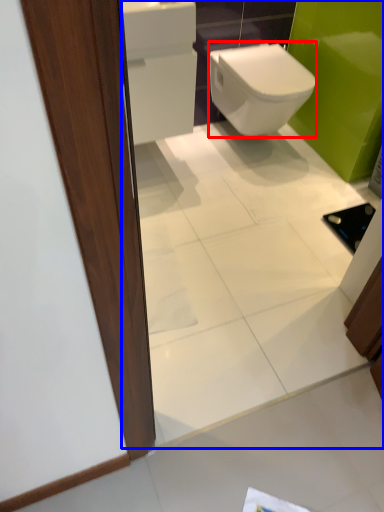
Question: Among these objects, which one is nearest to the camera, bidet (highlighted by a red box) or mirror (highlighted by a blue box)?

Choices:
 (A) bidet
 (B) mirror

Answer: (B)